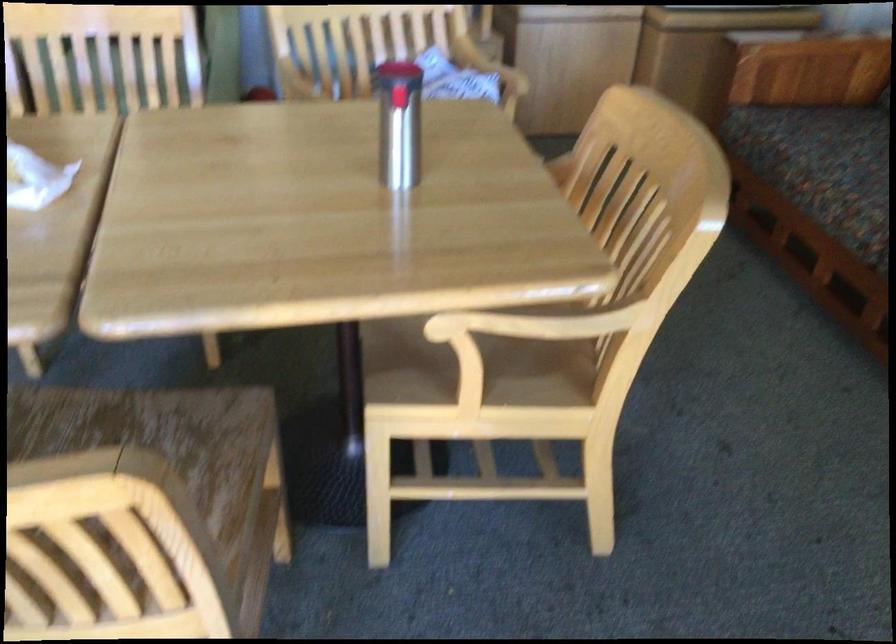
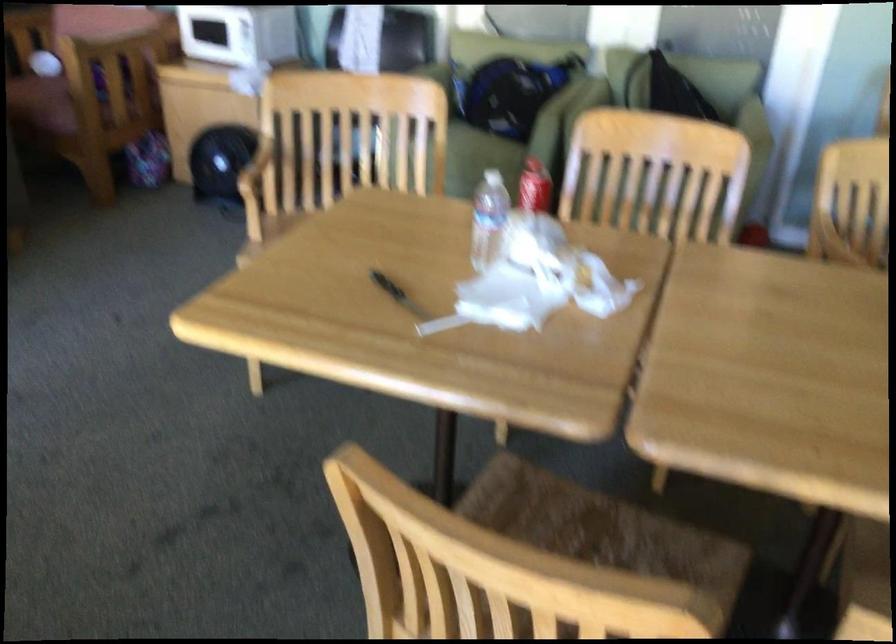
Where in the second image is the point corresponding to the point at 115,427 from the first image?

(597, 527)